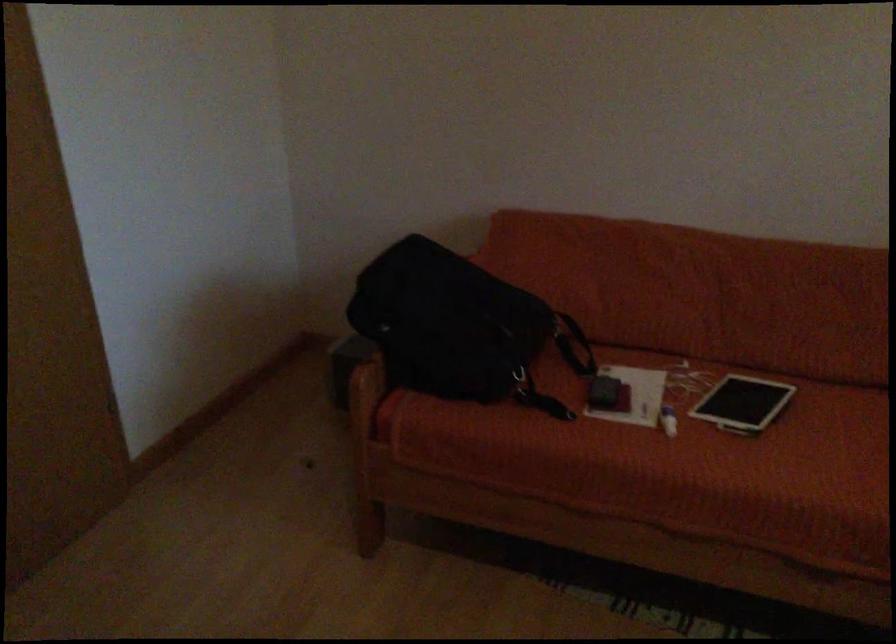
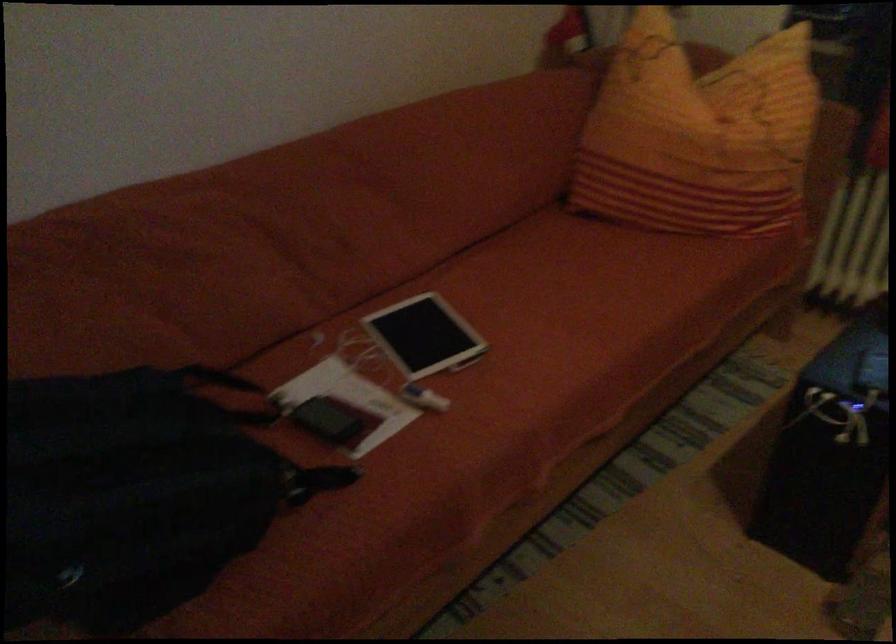
Question: I am providing you with two images of the same scene from different viewpoints. Which of the following objects are not visible in image2?

Choices:
 (A) dark mobile phone
 (B) white cylindrical object
 (C) black dustpan
 (D) small black tablet

Answer: (D)